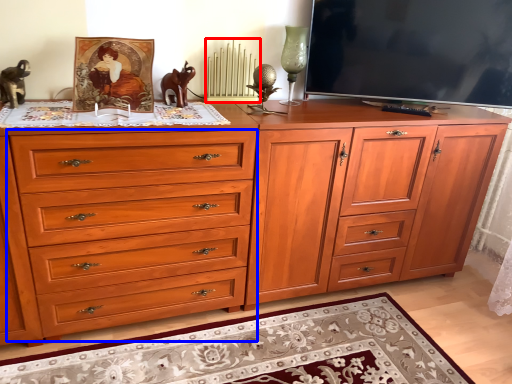
Question: Which point is closer to the camera, radiator (highlighted by a red box) or drawer (highlighted by a blue box)?

Choices:
 (A) radiator
 (B) drawer

Answer: (B)